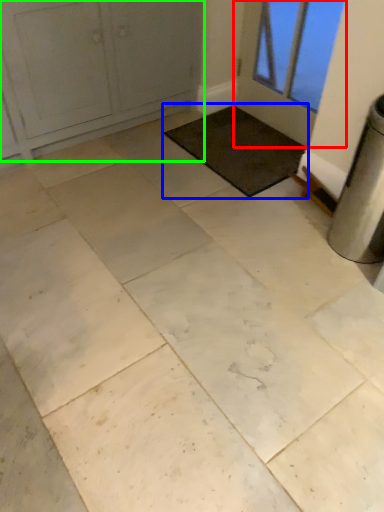
Question: Which is nearer to the door (highlighted by a red box)? mat (highlighted by a blue box) or door (highlighted by a green box).

Choices:
 (A) mat
 (B) door

Answer: (A)